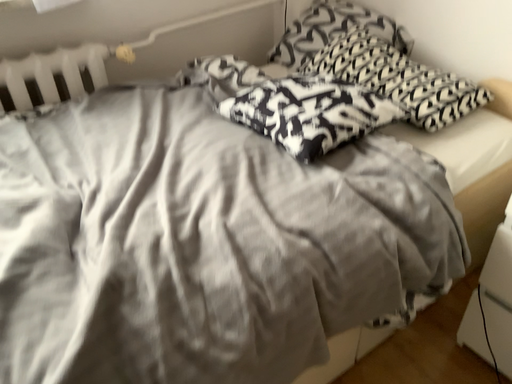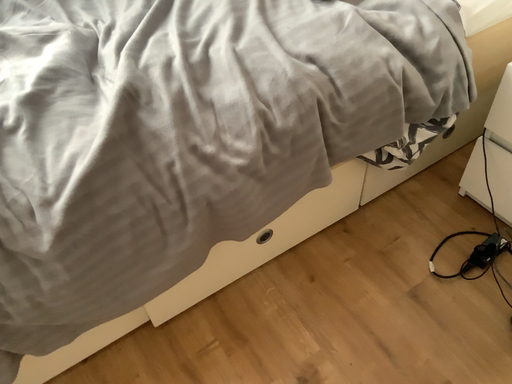
Question: Which way did the camera rotate in the video?

Choices:
 (A) rotated upward
 (B) rotated downward

Answer: (B)